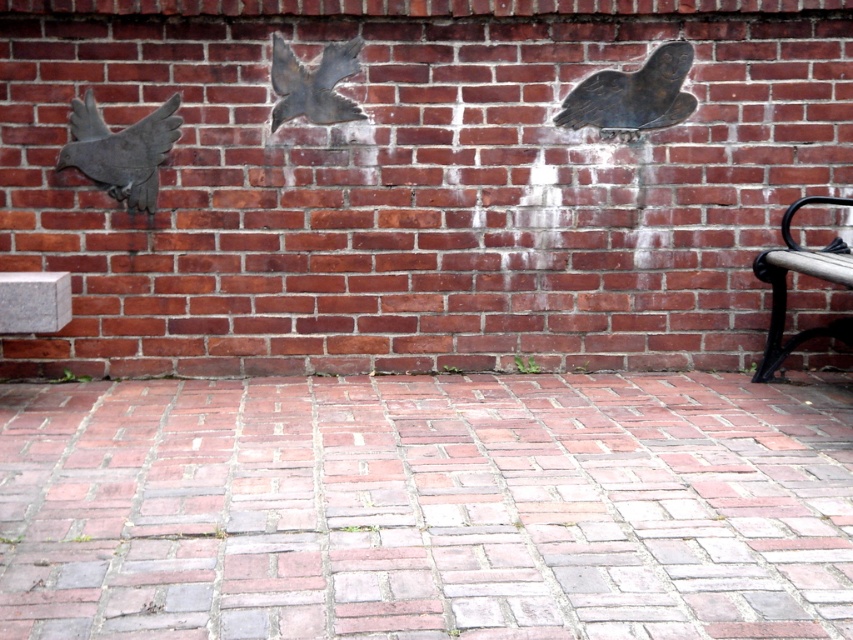
Is brushed metal pigeon at upper right below black metal bench at right?

No, brushed metal pigeon at upper right is not below black metal bench at right.

Measure the distance between point (637, 106) and camera.

Point (637, 106) and camera are 4.02 meters apart.

This screenshot has width=853, height=640. What do you see at coordinates (633, 96) in the screenshot? I see `brushed metal pigeon at upper right` at bounding box center [633, 96].

Find the location of `brushed metal pigeon at upper right`. brushed metal pigeon at upper right is located at coordinates (633, 96).

Does black metal bench at right have a greater width compared to shiny metallic pigeon at center?

Yes, black metal bench at right is wider than shiny metallic pigeon at center.

Based on the photo, does black metal bench at right lie in front of shiny metallic pigeon at center?

Yes, black metal bench at right is closer to the viewer.

Who is more distant from viewer, (775, 292) or (335, 97)?

Point (775, 292)

This screenshot has width=853, height=640. I want to click on black metal bench at right, so click(804, 273).

Measure the distance from brushed metal pigeon at left to shiny metallic pigeon at center.

A distance of 20.33 inches exists between brushed metal pigeon at left and shiny metallic pigeon at center.

In the scene shown: Between brushed metal pigeon at left and shiny metallic pigeon at center, which one is positioned higher?

shiny metallic pigeon at center is above.

Between point (68, 156) and point (309, 120), which one is positioned in front?

Point (68, 156) is more forward.

Find the location of a particular element. brushed metal pigeon at left is located at coordinates (120, 150).